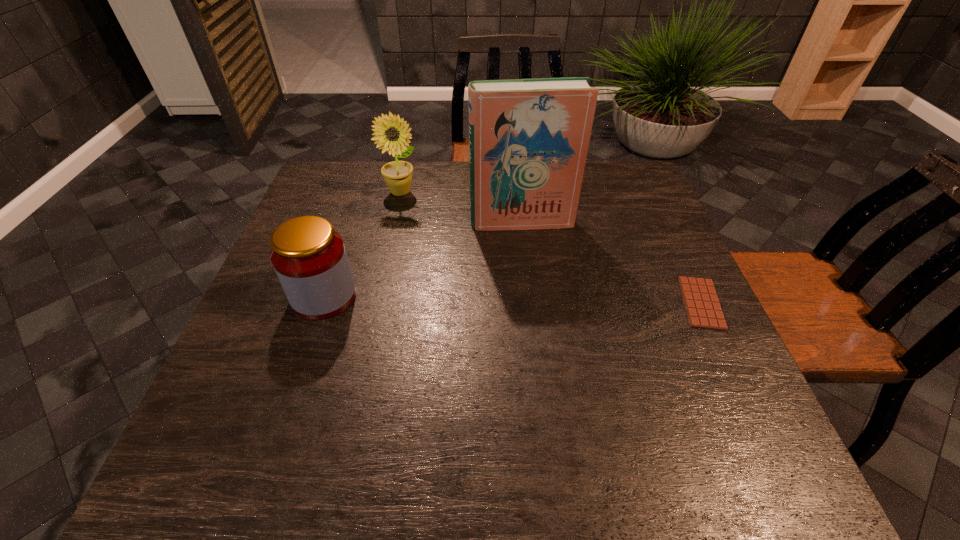
The width and height of the screenshot is (960, 540). I want to click on free space located on the face of the farthest object, so click(434, 227).

What are the coordinates of `vacant space located 0.360m on the face of the farthest object` in the screenshot? It's located at (474, 272).

Identify the location of vacant space located on the cover of the tallest object. (532, 256).

Identify the location of free space located 0.280m on the cover of the tallest object. This screenshot has width=960, height=540. [543, 309].

At what (x,y) coordinates should I click in order to perform the action: click on free space located 0.340m on the cover of the tallest object. Please return your answer as a coordinate pair (x, y). The width and height of the screenshot is (960, 540). Looking at the image, I should click on (548, 330).

Locate an element on the screen. This screenshot has width=960, height=540. object that is at the far edge is located at coordinates (392, 133).

Where is `object present at the left edge`? The height and width of the screenshot is (540, 960). object present at the left edge is located at coordinates (309, 257).

Locate an element on the screen. The height and width of the screenshot is (540, 960). object that is at the right edge is located at coordinates (703, 309).

Locate an element on the screen. This screenshot has height=540, width=960. vacant space at the near edge is located at coordinates (319, 401).

In the image, there is a desktop. Where is `vacant space at the left edge`? vacant space at the left edge is located at coordinates (356, 208).